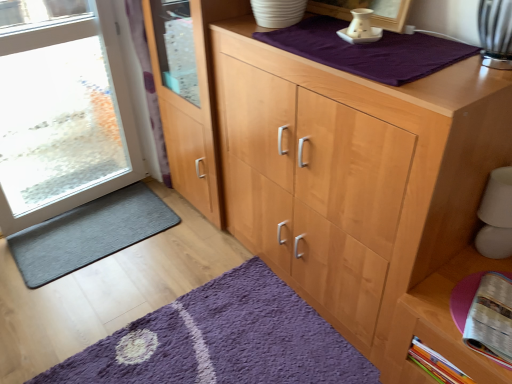
Question: From a real-world perspective, is printed paper magazine at lower right positioned above or below transparent glass door at left?

Choices:
 (A) above
 (B) below

Answer: (B)

Question: From the image's perspective, relative to transparent glass door at left, is printed paper magazine at lower right above or below?

Choices:
 (A) below
 (B) above

Answer: (A)

Question: Estimate the real-world distances between objects in this image. Which object is farther from the transparent glass door at left?

Choices:
 (A) dark gray textured mat at lower left, the first doormat viewed from the back
 (B) clear glass door at left
 (C) purple shaggy rug at lower center, which is the second doormat from top to bottom
 (D) light wood cupboard at center
 (E) wooden cabinet at lower right

Answer: (E)

Question: Which is nearer to the wooden cabinet at lower right?

Choices:
 (A) dark gray textured mat at lower left, the 2th doormat from the bottom
 (B) purple cotton blanket at upper center
 (C) transparent glass door at left
 (D) printed paper magazine at lower right
 (E) purple shaggy rug at lower center, which is the second doormat from top to bottom

Answer: (D)